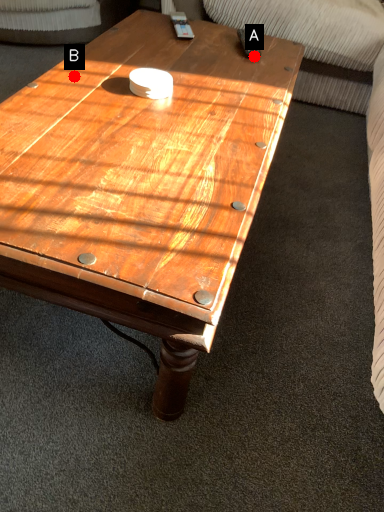
Question: Two points are circled on the image, labeled by A and B beside each circle. Which point is closer to the camera?

Choices:
 (A) A is closer
 (B) B is closer

Answer: (B)